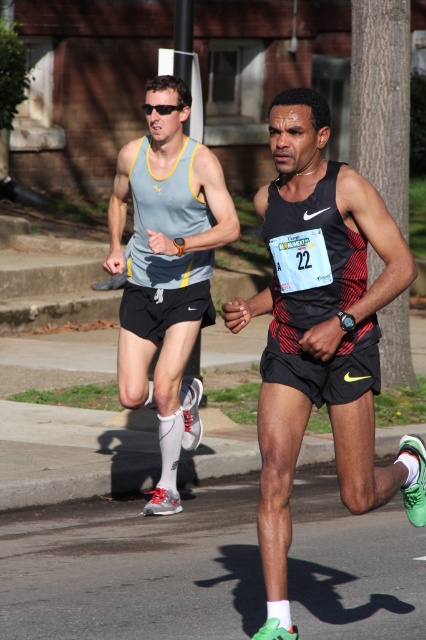
Is green matte running shoe at right taller than matte gray tank top at left?

No, green matte running shoe at right is not taller than matte gray tank top at left.

Which is in front, point (348, 291) or point (129, 392)?

Positioned in front is point (348, 291).

Find the location of `green matte running shoe at right`. green matte running shoe at right is located at coordinates (321, 333).